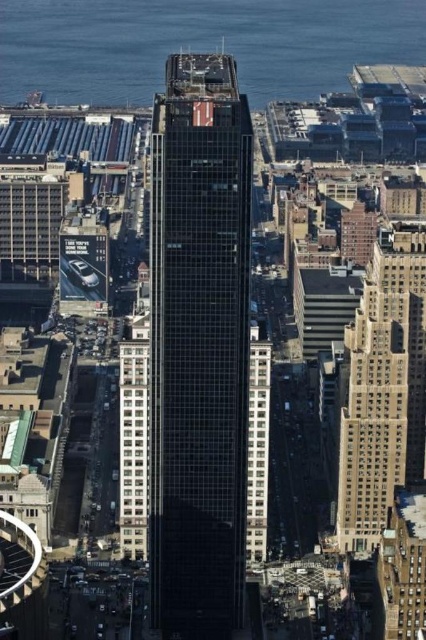
Question: Which object is the farthest from the black glass skyscraper at center?

Choices:
 (A) beige stone building at right
 (B) blue glass water at upper center

Answer: (B)

Question: Which is farther from the black glass skyscraper at center?

Choices:
 (A) blue glass water at upper center
 (B) beige stone building at right

Answer: (A)

Question: Can you confirm if black glass skyscraper at center is thinner than beige stone building at right?

Choices:
 (A) yes
 (B) no

Answer: (B)

Question: Can you confirm if black glass skyscraper at center is wider than beige stone building at right?

Choices:
 (A) no
 (B) yes

Answer: (B)

Question: Which point is farther from the camera taking this photo?

Choices:
 (A) (199, 588)
 (B) (227, 44)
 (C) (408, 451)

Answer: (A)

Question: Can you confirm if black glass skyscraper at center is positioned to the right of blue glass water at upper center?

Choices:
 (A) yes
 (B) no

Answer: (B)